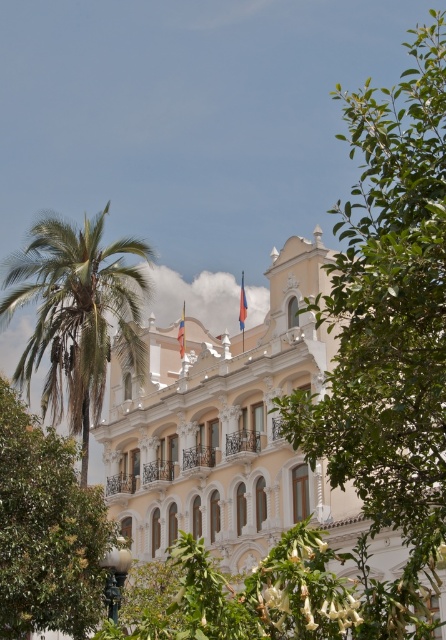
What do you see at coordinates (388, 324) in the screenshot? The width and height of the screenshot is (446, 640). I see `green leafy tree at upper right` at bounding box center [388, 324].

Is green leafy tree at upper right thinner than green leafy palm tree at left?

Incorrect, green leafy tree at upper right's width is not less than green leafy palm tree at left's.

At what (x,y) coordinates should I click in order to perform the action: click on green leafy tree at upper right. Please return your answer as a coordinate pair (x, y). The height and width of the screenshot is (640, 446). Looking at the image, I should click on (388, 324).

Who is lower down, green leafy tree at center or orange fabric flag at upper center?

green leafy tree at center

What do you see at coordinates (46, 531) in the screenshot? The height and width of the screenshot is (640, 446). I see `green leafy tree at center` at bounding box center [46, 531].

Where is `green leafy tree at center`? green leafy tree at center is located at coordinates (46, 531).

Does green leafy palm tree at left appear on the right side of red fabric flag at center?

In fact, green leafy palm tree at left is to the left of red fabric flag at center.

Is green leafy palm tree at left taller than red fabric flag at center?

Indeed, green leafy palm tree at left has a greater height compared to red fabric flag at center.

Identify the location of green leafy palm tree at left. The height and width of the screenshot is (640, 446). (77, 314).